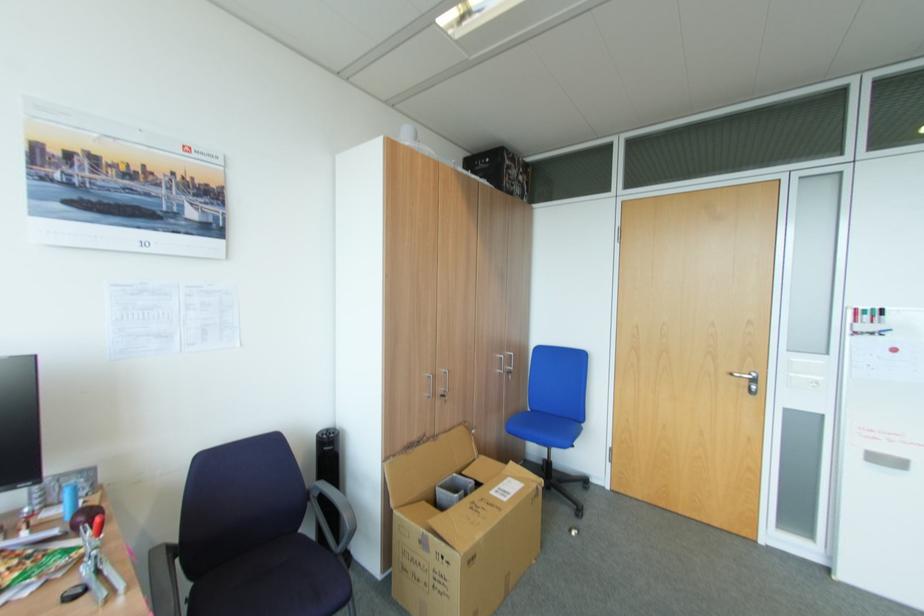
Where would you sit the dark blue chair sitting surface? Please return your answer as a coordinate pair (x, y).

(274, 582)